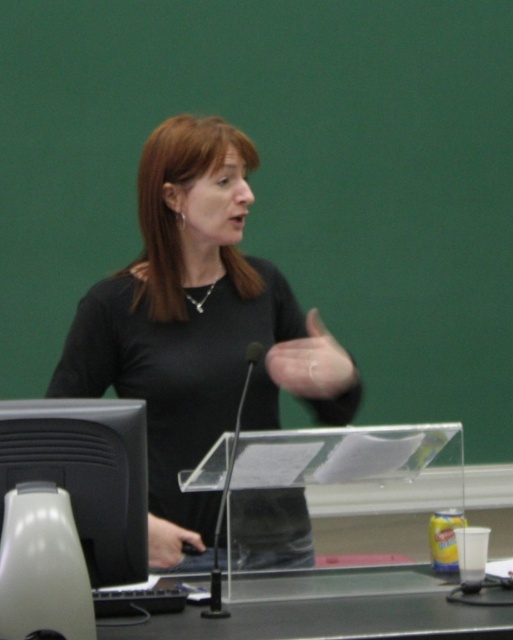
Question: Considering the real-world distances, which object is farthest from the black matte shirt at center?

Choices:
 (A) black glossy monitor at lower left
 (B) green plastic table at lower center

Answer: (A)

Question: Does black matte shirt at center have a lesser width compared to green plastic table at lower center?

Choices:
 (A) yes
 (B) no

Answer: (A)

Question: Which of these objects is positioned closest to the black matte shirt at center?

Choices:
 (A) green plastic table at lower center
 (B) black glossy monitor at lower left

Answer: (A)

Question: In this image, where is black matte shirt at center located relative to green plastic table at lower center?

Choices:
 (A) left
 (B) right

Answer: (A)

Question: Is black matte shirt at center to the left of green plastic table at lower center from the viewer's perspective?

Choices:
 (A) no
 (B) yes

Answer: (B)

Question: Which point is closer to the camera?

Choices:
 (A) green plastic table at lower center
 (B) black glossy monitor at lower left

Answer: (A)